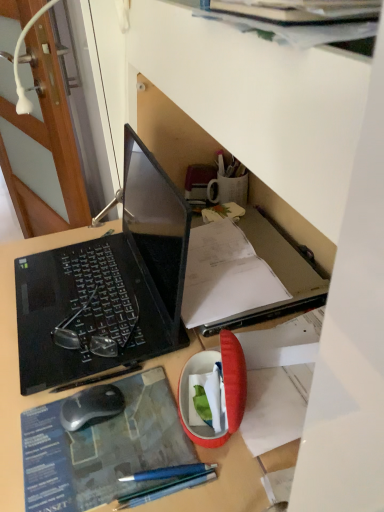
Question: Considering the relative sizes of wooden door at left and blue paper at center in the image provided, is wooden door at left bigger than blue paper at center?

Choices:
 (A) no
 (B) yes

Answer: (B)

Question: Does wooden door at left have a lesser height compared to blue paper at center?

Choices:
 (A) no
 (B) yes

Answer: (A)

Question: From the image's perspective, would you say wooden door at left is positioned over blue paper at center?

Choices:
 (A) no
 (B) yes

Answer: (B)

Question: Is wooden door at left at the left side of blue paper at center?

Choices:
 (A) yes
 (B) no

Answer: (A)

Question: Is wooden door at left closer to the viewer compared to blue paper at center?

Choices:
 (A) no
 (B) yes

Answer: (A)

Question: Looking at their shapes, would you say black matte laptop at left is wider or thinner than blue paper at center?

Choices:
 (A) wide
 (B) thin

Answer: (A)

Question: From a real-world perspective, is black matte laptop at left above or below blue paper at center?

Choices:
 (A) below
 (B) above

Answer: (B)

Question: Is black matte laptop at left spatially inside blue paper at center, or outside of it?

Choices:
 (A) outside
 (B) inside

Answer: (A)

Question: Is black matte laptop at left to the left or to the right of blue paper at center in the image?

Choices:
 (A) left
 (B) right

Answer: (A)

Question: In terms of height, does wooden door at left look taller or shorter compared to blue paper at center?

Choices:
 (A) short
 (B) tall

Answer: (B)

Question: Is wooden door at left in front of or behind blue paper at center in the image?

Choices:
 (A) behind
 (B) front

Answer: (A)

Question: From a real-world perspective, is wooden door at left above or below blue paper at center?

Choices:
 (A) below
 (B) above

Answer: (A)

Question: Would you say wooden door at left is inside or outside blue paper at center?

Choices:
 (A) inside
 (B) outside

Answer: (B)

Question: From a real-world perspective, relative to wooden door at left, is black matte laptop at left vertically above or below?

Choices:
 (A) above
 (B) below

Answer: (A)

Question: Considering the positions of black matte laptop at left and wooden door at left in the image, is black matte laptop at left bigger or smaller than wooden door at left?

Choices:
 (A) small
 (B) big

Answer: (A)